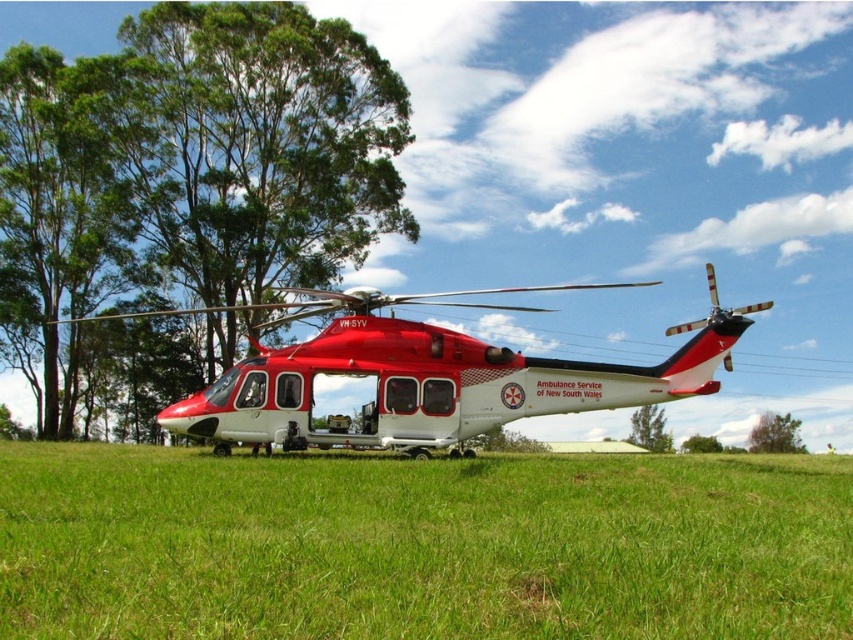
Which of these two, matte red helicopter at center or green leafy tree at center, stands taller?

matte red helicopter at center

Can you confirm if matte red helicopter at center is positioned below green leafy tree at center?

No, matte red helicopter at center is not below green leafy tree at center.

Which is in front, point (363, 339) or point (759, 428)?

Point (363, 339) is more forward.

The width and height of the screenshot is (853, 640). I want to click on matte red helicopter at center, so click(x=426, y=376).

Does green grass at center have a smaller size compared to green leafy tree at center?

Actually, green grass at center might be larger than green leafy tree at center.

Looking at this image, is green grass at center taller than green leafy tree at center?

Indeed, green grass at center has a greater height compared to green leafy tree at center.

In order to click on green grass at center in this screenshot , I will do `click(421, 545)`.

I want to click on green grass at center, so click(421, 545).

Who is higher up, green leafy tree at upper left or matte red helicopter at center?

Positioned higher is green leafy tree at upper left.

Where is `green leafy tree at upper left`? The width and height of the screenshot is (853, 640). green leafy tree at upper left is located at coordinates (184, 189).

Between point (209, 321) and point (695, 323), which one is positioned in front?

Point (695, 323)

Where is `green leafy tree at upper left`? green leafy tree at upper left is located at coordinates (184, 189).